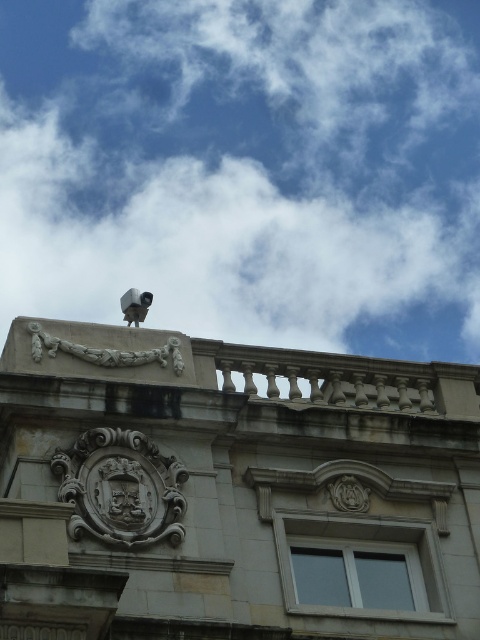
Question: From the image, what is the correct spatial relationship of white fluffy cloud at upper center in relation to white stone sculpture at upper center?

Choices:
 (A) right
 (B) left

Answer: (A)

Question: Can you confirm if white fluffy cloud at upper center is positioned to the left of white stone sculpture at upper center?

Choices:
 (A) yes
 (B) no

Answer: (B)

Question: Considering the relative positions of white fluffy cloud at upper center and white stone sculpture at upper center in the image provided, where is white fluffy cloud at upper center located with respect to white stone sculpture at upper center?

Choices:
 (A) right
 (B) left

Answer: (A)

Question: Which object appears closest to the camera in this image?

Choices:
 (A) white fluffy cloud at upper center
 (B) white stone sculpture at upper center

Answer: (B)